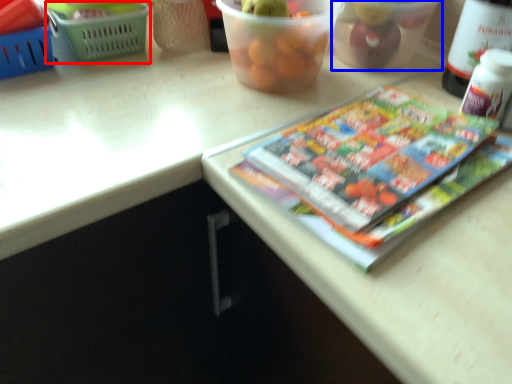
Question: Which object is further to the camera taking this photo, basket (highlighted by a red box) or glass bowl (highlighted by a blue box)?

Choices:
 (A) basket
 (B) glass bowl

Answer: (A)